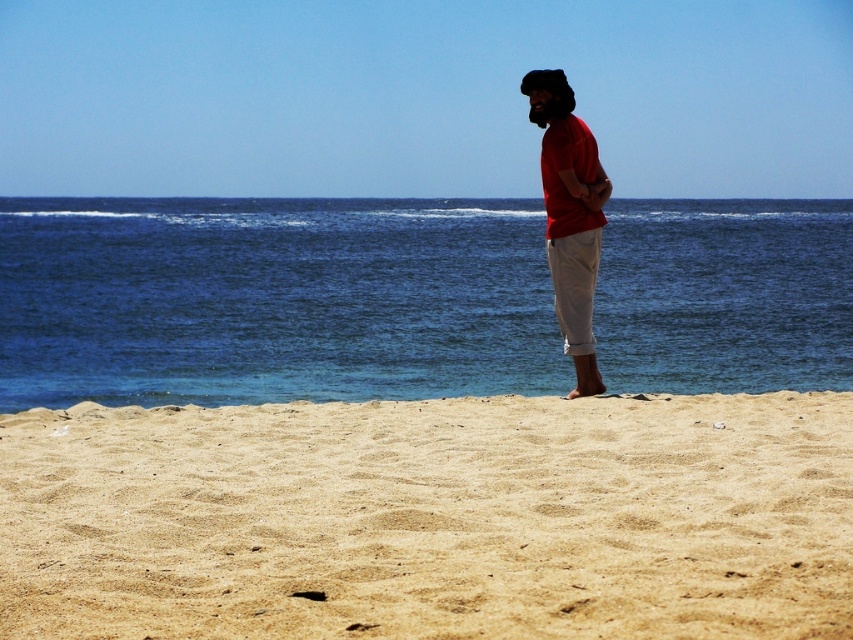
Question: Is blue water at center further to camera compared to matte red shirt at center?

Choices:
 (A) yes
 (B) no

Answer: (A)

Question: Does blue water at center appear under matte red shirt at center?

Choices:
 (A) yes
 (B) no

Answer: (B)

Question: Which object is positioned closest to the matte red shirt at center?

Choices:
 (A) blue water at center
 (B) fine-grained sand at lower center

Answer: (B)

Question: Can you confirm if blue water at center is wider than matte red shirt at center?

Choices:
 (A) no
 (B) yes

Answer: (B)

Question: Which point is farther to the camera?

Choices:
 (A) (621, 301)
 (B) (149, 451)

Answer: (A)

Question: Which of the following is the farthest from the observer?

Choices:
 (A) blue water at center
 (B) matte red shirt at center
 (C) fine-grained sand at lower center

Answer: (A)